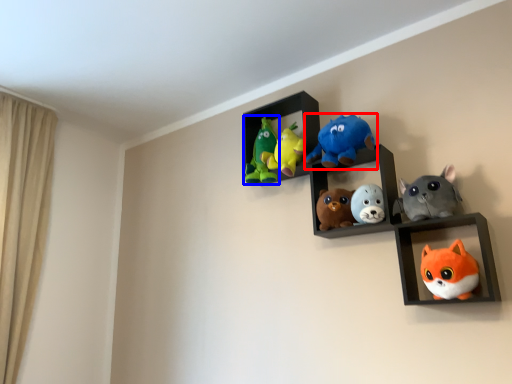
Question: Among these objects, which one is farthest to the camera, toy (highlighted by a red box) or toy (highlighted by a blue box)?

Choices:
 (A) toy
 (B) toy

Answer: (B)